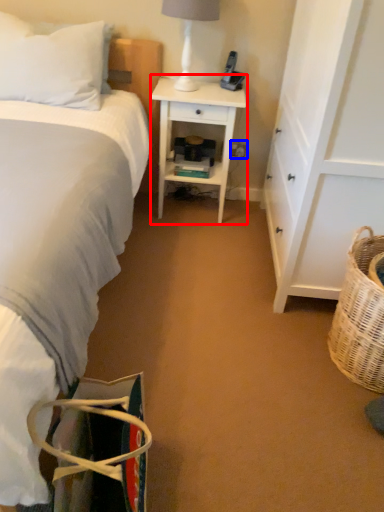
Question: Which of the following is the closest to the observer, desk (highlighted by a red box) or electric outlet (highlighted by a blue box)?

Choices:
 (A) desk
 (B) electric outlet

Answer: (A)